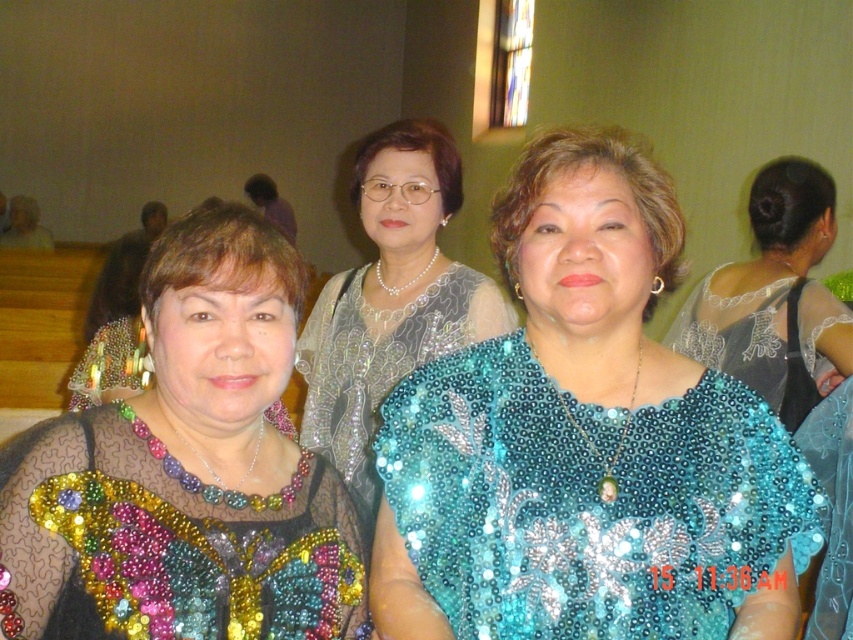
Based on the coordinates provided, which object corresponds to the point (585,442) in the image?

The teal sequined blouse at center corresponds to the point (585,442).

You are a photographer preparing to take a group photo of the women in the scene. You need to ensure that both the beaded fabric dress at center and the pearl necklace at center are clearly visible in the photo. Which object should you focus on to ensure both are in focus, and why?

The beaded fabric dress at center is smaller than the pearl necklace at center. To ensure both are in focus, you should focus on the pearl necklace at center because it is larger and will be easier to capture clearly, while the smaller beaded fabric dress at center will also be within the depth of field.

Based on the scene description, where is the multicolored sequined blouse at center located in terms of its 2D coordinates?

The multicolored sequined blouse at center is located at the 2D coordinates point (189, 472).